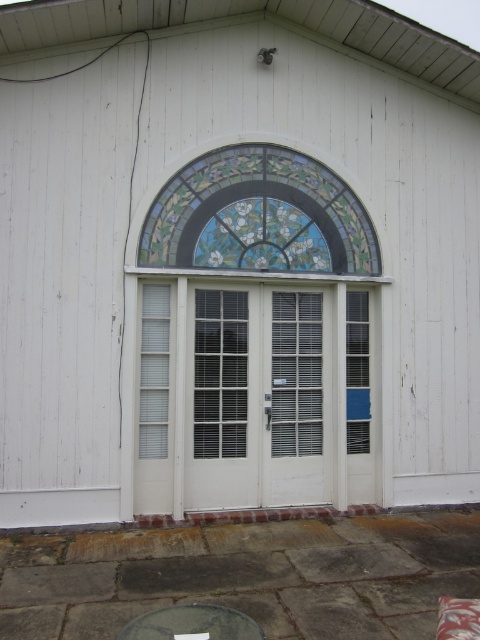
Is stained glass at center further to camera compared to smooth gray table at lower center?

Yes, it is.

Measure the distance from stained glass at center to smooth gray table at lower center.

stained glass at center is 11.35 feet away from smooth gray table at lower center.

Image resolution: width=480 pixels, height=640 pixels. Identify the location of stained glass at center. (259, 216).

Between white textured glass door at center and smooth gray table at lower center, which one is positioned lower?

smooth gray table at lower center is lower down.

Can you confirm if white textured glass door at center is positioned to the left of smooth gray table at lower center?

Incorrect, white textured glass door at center is not on the left side of smooth gray table at lower center.

Does point (191, 321) come in front of point (163, 611)?

No, it is not.

Where is `white textured glass door at center`? Image resolution: width=480 pixels, height=640 pixels. white textured glass door at center is located at coordinates (256, 397).

Does point (160, 618) come farther from viewer compared to point (458, 628)?

Yes, point (160, 618) is farther from viewer.

Is point (241, 612) closer to viewer compared to point (455, 611)?

No.

Is point (224, 628) closer to viewer compared to point (463, 628)?

No, it is behind (463, 628).

Identify the location of smooth gray table at lower center. [x=192, y=624].